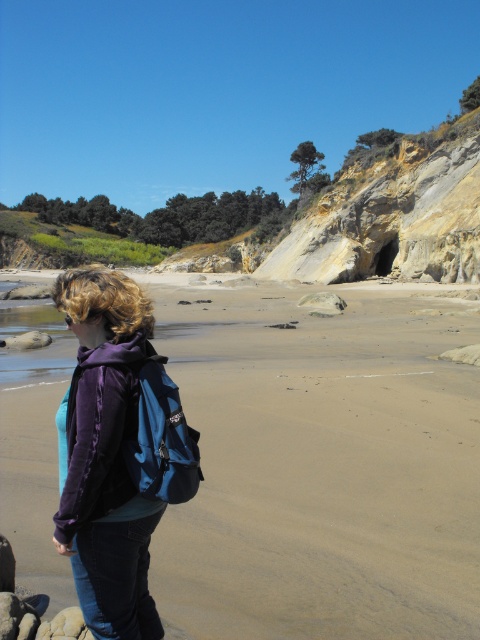
You are a hiker who needs to place a 10 meter long tent between the brown sandy beach at lower center and the purple fleece jacket at lower left. Is there enough space between them to set up the tent?

The distance between the brown sandy beach at lower center and the purple fleece jacket at lower left is 20.25 meters, which is more than enough space to place a 10 meter long tent between them.

Based on the photo, you are standing on the beach and want to walk to both the point at coordinates (122, 612) and the point at (332, 296). Which point should you visit first to minimize the total distance walked?

You should visit point (122, 612) first because it is closer to you than point (332, 296). After visiting the closer point, you can proceed to the farther one, resulting in a shorter total distance walked.

You are a hiker trying to find a place to set up your tent. You have two options on the beach scene shown. Which location would provide a more stable and flat surface for your tent, the brown sandy beach at lower center or the smooth gray rock at center?

The brown sandy beach at lower center has a larger size compared to the smooth gray rock at center, so it would provide a more stable and flat surface for setting up the tent.